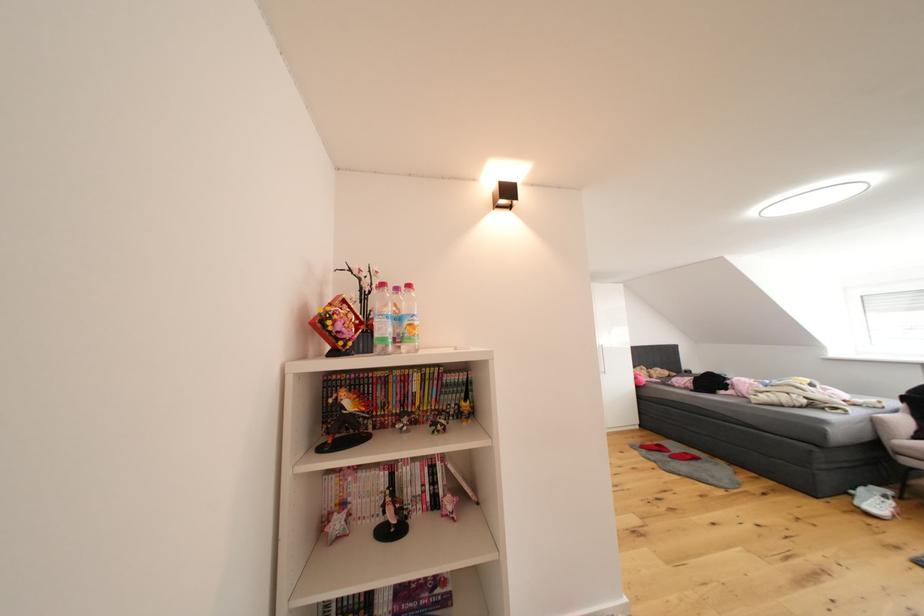
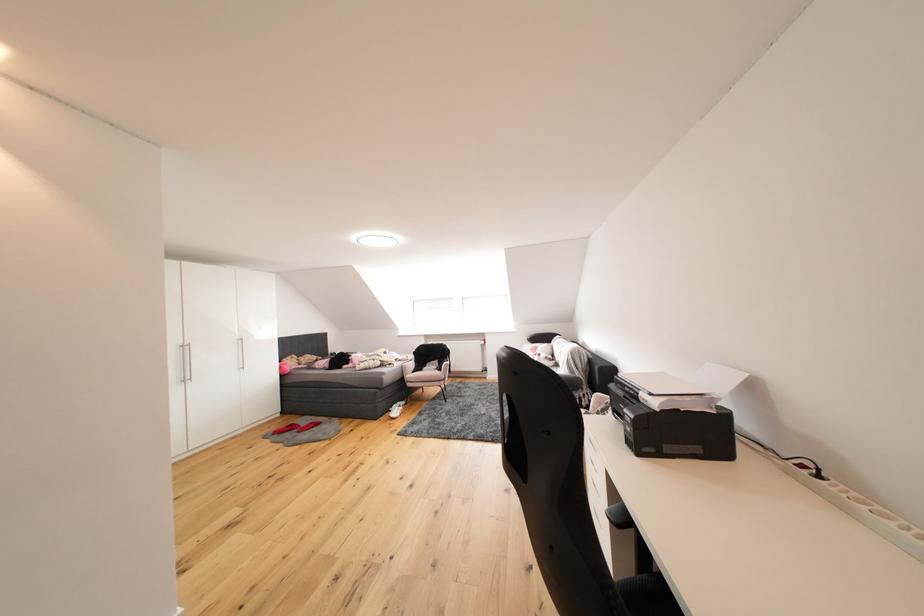
Locate, in the second image, the point that corresponds to (x=683, y=450) in the first image.

(313, 424)